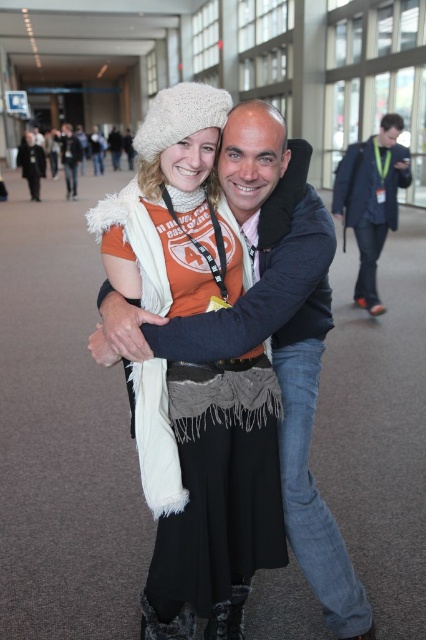
Consider the image. Is dark blue suit at center wider than white woolen hat at upper center?

No.

Based on the photo, can you confirm if dark blue suit at center is shorter than white woolen hat at upper center?

Correct, dark blue suit at center is not as tall as white woolen hat at upper center.

Where is `dark blue suit at center`? dark blue suit at center is located at coordinates pos(371,198).

Is point (80, 145) less distant than point (60, 147)?

Yes.

Can you confirm if white woolen hat at upper center is positioned to the left of matte black jacket at center?

Indeed, white woolen hat at upper center is positioned on the left side of matte black jacket at center.

Is point (39, 177) behind point (78, 160)?

Yes, it is.

Identify the location of white woolen hat at upper center. (31, 163).

Which is below, white fuzzy hat at upper center or dark blue suit at center?

white fuzzy hat at upper center is lower down.

Which of these two, white fuzzy hat at upper center or dark blue suit at center, stands shorter?

Standing shorter between the two is white fuzzy hat at upper center.

Between point (198, 113) and point (376, 232), which one is positioned behind?

Point (376, 232)

You are a GUI agent. You are given a task and a screenshot of the screen. Output one action in this format:
    pyautogui.click(x=<x>, y=<y>)
    Task: Click on the white fuzzy hat at upper center
    This screenshot has width=426, height=640.
    Given the screenshot: What is the action you would take?
    pyautogui.click(x=210, y=490)